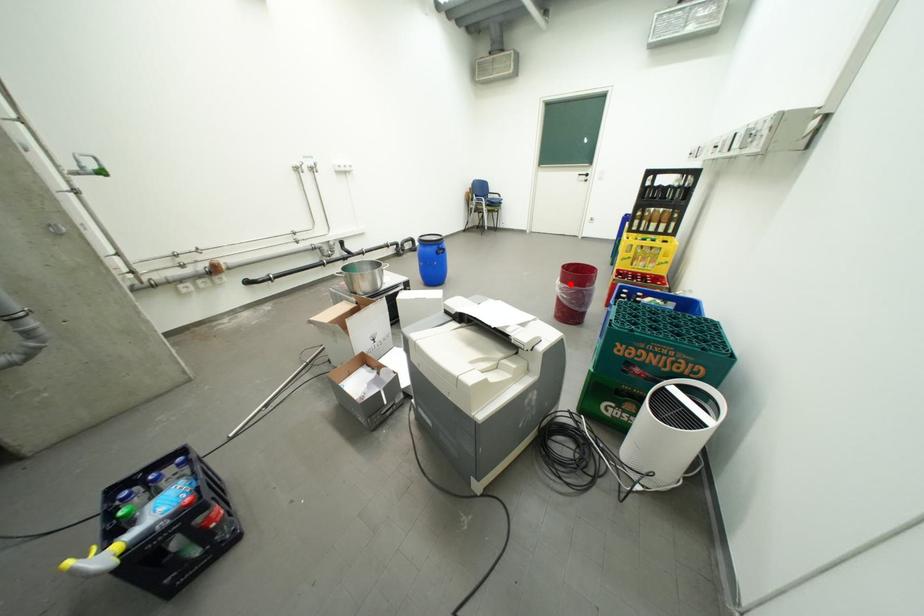
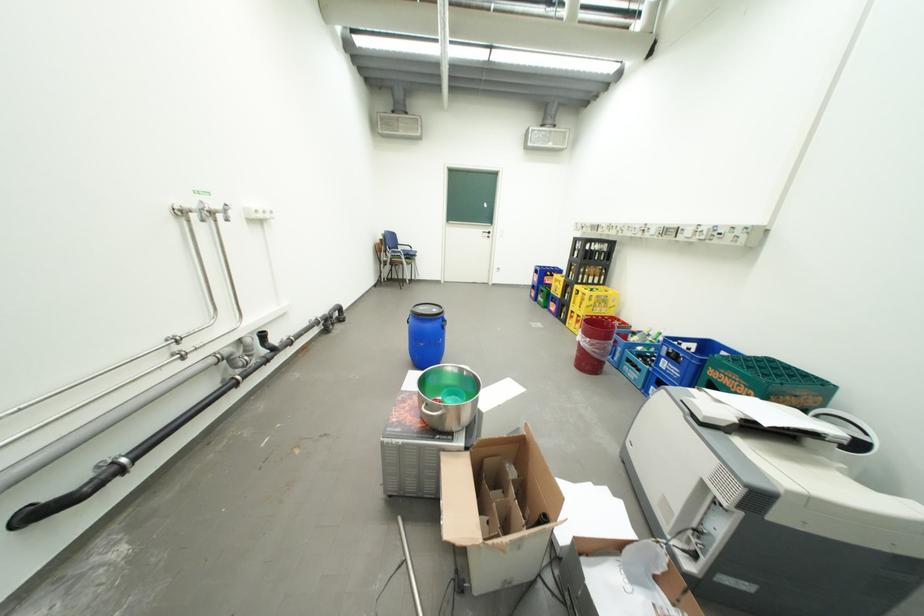
Where in the second image is the point corresponding to the highlighted location from the first image?

(599, 341)